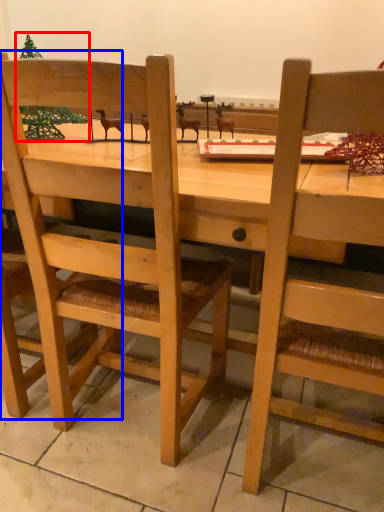
Question: Which point is further to the camera, christmas tree (highlighted by a red box) or chair (highlighted by a blue box)?

Choices:
 (A) christmas tree
 (B) chair

Answer: (A)